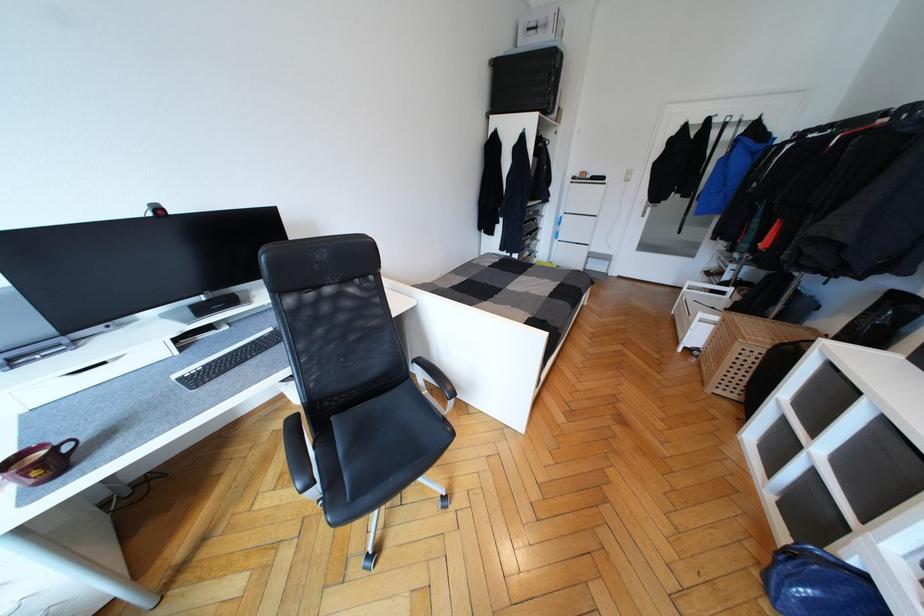
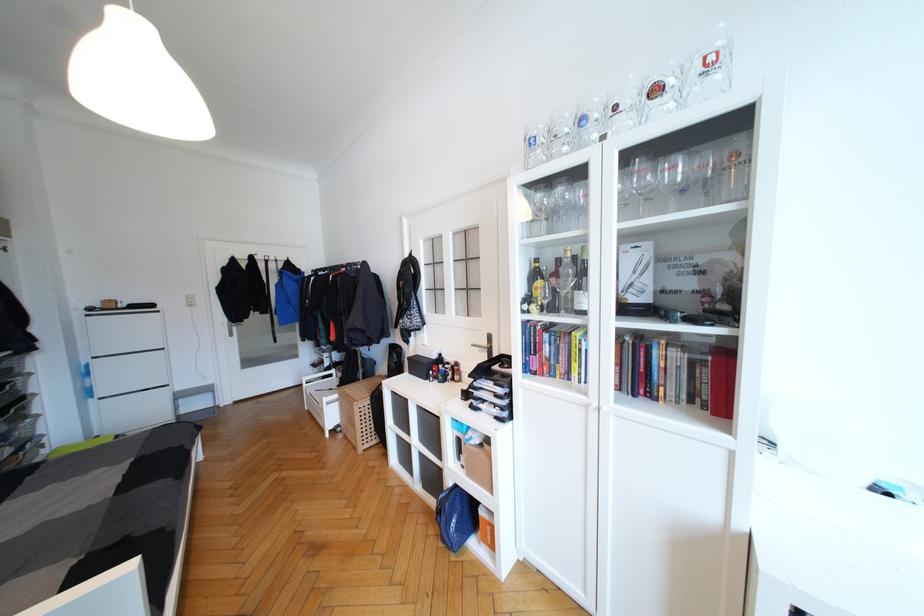
Question: The camera is either moving clockwise (left) or counter-clockwise (right) around the object. The first image is from the beginning of the video and the second image is from the end. Is the camera moving left or right when shooting the video?

Choices:
 (A) Left
 (B) Right

Answer: (A)